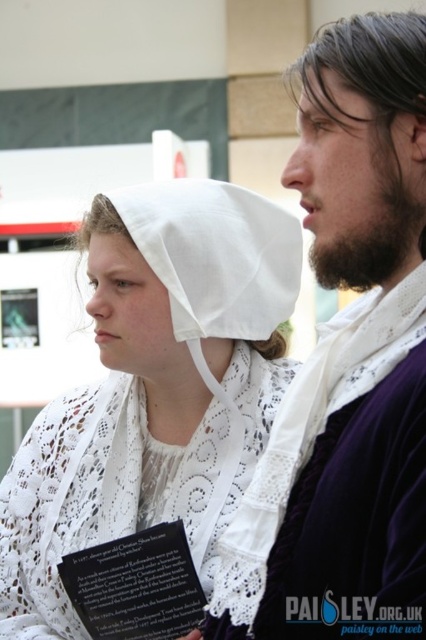
Question: Which point is farther to the camera?

Choices:
 (A) (147, 547)
 (B) (94, 429)
 (C) (249, 228)

Answer: (B)

Question: In this image, where is velvet purple robe at center located relative to white cotton bonnet at center?

Choices:
 (A) below
 (B) above

Answer: (B)

Question: Does white lace bonnet at center have a greater width compared to white cotton bonnet at center?

Choices:
 (A) no
 (B) yes

Answer: (B)

Question: From the image, what is the correct spatial relationship of velvet purple robe at center in relation to white lace bonnet at center?

Choices:
 (A) left
 (B) right

Answer: (B)

Question: Which point is farther from the camera taking this photo?

Choices:
 (A) (195, 340)
 (B) (28, 472)

Answer: (B)

Question: Which object is the farthest from the black paper at lower left?

Choices:
 (A) velvet purple robe at center
 (B) white cotton bonnet at center

Answer: (B)